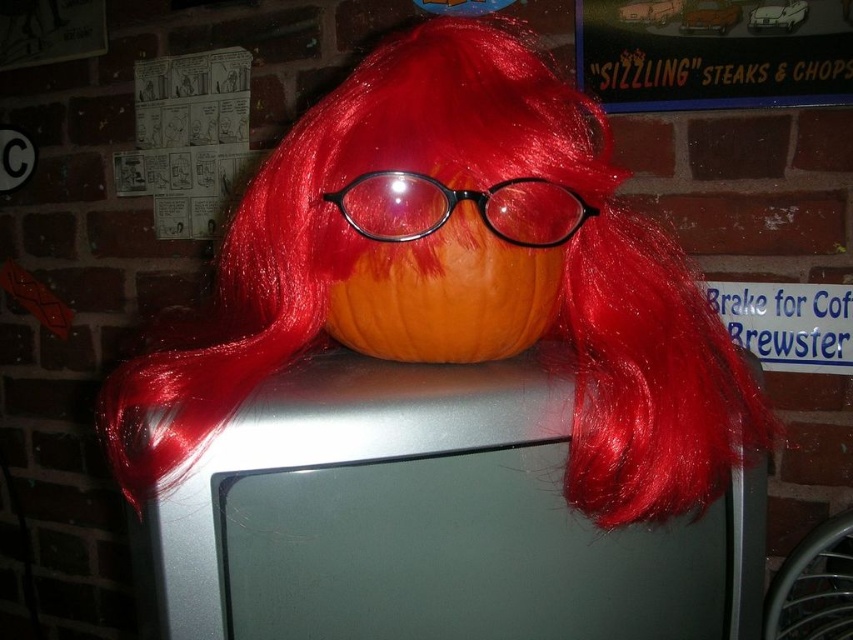
You are setting up a Halloween display and want to ensure the orange matte pumpkin at center is visible. Since the black plastic glasses at center are part of the decoration, where should you position the glasses relative to the pumpkin to avoid blocking its view?

The orange matte pumpkin at center is located below the black plastic glasses at center, so positioning the glasses above the pumpkin would ensure the pumpkin remains visible without obstruction.

You are standing in front of a pumpkin dressed as a bird on a vintage TV. There are two points marked in the image. Which point is closer to you, point (x=399, y=120) or point (x=560, y=209)?

Point (x=399, y=120) is in front of point (x=560, y=209), so it is closer to you.